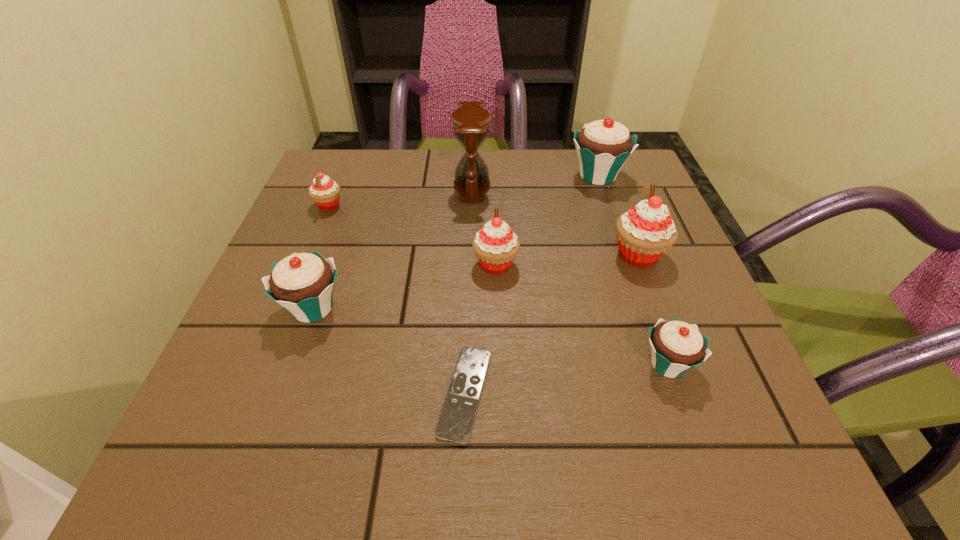
Where is `free space located on the right of the remote control`? This screenshot has width=960, height=540. free space located on the right of the remote control is located at coordinates (655, 393).

The height and width of the screenshot is (540, 960). What are the coordinates of `hourglass located in the far edge section of the desktop` in the screenshot? It's located at (471, 122).

The height and width of the screenshot is (540, 960). Find the location of `object at the near edge`. object at the near edge is located at coordinates (455, 424).

Locate an element on the screen. Image resolution: width=960 pixels, height=540 pixels. object at the far left corner is located at coordinates (325, 192).

In order to click on object at the far right corner in this screenshot , I will do `click(603, 146)`.

Identify the location of free space at the far edge. (491, 161).

This screenshot has height=540, width=960. Find the location of `blank space at the near edge of the desktop`. blank space at the near edge of the desktop is located at coordinates (318, 442).

At what (x,y) coordinates should I click in order to perform the action: click on vacant space at the left edge. Please return your answer as a coordinate pair (x, y). The image size is (960, 540). Looking at the image, I should click on (229, 379).

This screenshot has height=540, width=960. In the image, there is a desktop. In order to click on vacant space at the right edge in this screenshot , I will do `click(622, 300)`.

Where is `free region at the far left corner of the desktop`? This screenshot has width=960, height=540. free region at the far left corner of the desktop is located at coordinates (367, 200).